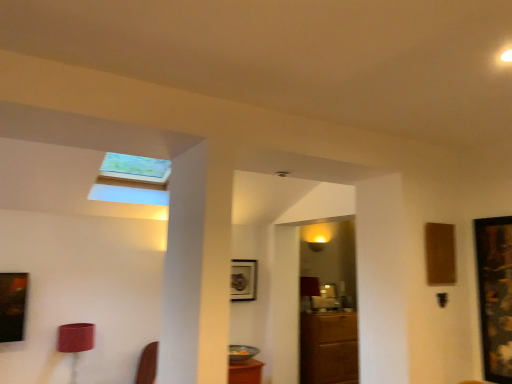
What do you see at coordinates (495, 295) in the screenshot? I see `wooden framed artwork at right, the 2th picture frame positioned from the left` at bounding box center [495, 295].

In order to face metallic silver picture frame at center, placed as the second picture frame when sorted from front to back, should I rotate leftwards or rightwards?

To align with it, rotate left about 1.560°.

The image size is (512, 384). Describe the element at coordinates (328, 348) in the screenshot. I see `brown wooden cabinet at center` at that location.

The width and height of the screenshot is (512, 384). Identify the location of wooden framed artwork at right, acting as the 1th picture frame starting from the right. (495, 295).

What's the angular difference between brown wooden cabinet at center and metallic silver picture frame at center, placed as the second picture frame when sorted from front to back,'s facing directions?

They differ by 1.19 degrees in their facing directions.

Is brown wooden cabinet at center positioned beyond the bounds of metallic silver picture frame at center, placed as the second picture frame when sorted from front to back?

Yes.

From a real-world perspective, which is physically below, brown wooden cabinet at center or metallic silver picture frame at center, marked as the 2th picture frame in a right-to-left arrangement?

brown wooden cabinet at center.

Considering the points (352, 311) and (234, 268), which point is behind, point (352, 311) or point (234, 268)?

The point (352, 311) is farther from the camera.

Would you consider wooden framed artwork at right, the 2th picture frame positioned from the left, to be distant from brown wooden cabinet at center?

wooden framed artwork at right, the 2th picture frame positioned from the left, is far away from brown wooden cabinet at center.

Based on the photo, from a real-world perspective, who is located higher, wooden framed artwork at right, the 2th picture frame positioned from the left, or brown wooden cabinet at center?

wooden framed artwork at right, the 2th picture frame positioned from the left.

In the scene shown: Is wooden framed artwork at right, acting as the 1th picture frame starting from the right, located outside brown wooden cabinet at center?

Indeed, wooden framed artwork at right, acting as the 1th picture frame starting from the right, is completely outside brown wooden cabinet at center.

Does wooden framed artwork at right, acting as the 1th picture frame starting from the right, have a greater width compared to brown wooden cabinet at center?

In fact, wooden framed artwork at right, acting as the 1th picture frame starting from the right, might be narrower than brown wooden cabinet at center.

How different are the orientations of metallic silver picture frame at center, which is counted as the 1th picture frame, starting from the back, and brown wooden cabinet at center in degrees?

1.19 degrees separate the facing orientations of metallic silver picture frame at center, which is counted as the 1th picture frame, starting from the back, and brown wooden cabinet at center.

Which is farther, (236, 271) or (334, 345)?

The point (334, 345) is farther.

Can you confirm if metallic silver picture frame at center, which is counted as the 1th picture frame, starting from the back, is smaller than brown wooden cabinet at center?

Yes, metallic silver picture frame at center, which is counted as the 1th picture frame, starting from the back, is smaller than brown wooden cabinet at center.

Is metallic silver picture frame at center, which is counted as the 1th picture frame, starting from the back, aimed at wooden framed artwork at right, the first picture frame when ordered from front to back?

Yes, metallic silver picture frame at center, which is counted as the 1th picture frame, starting from the back, is facing wooden framed artwork at right, the first picture frame when ordered from front to back.

How distant is metallic silver picture frame at center, placed as the second picture frame when sorted from front to back, from wooden framed artwork at right, the first picture frame when ordered from front to back?

metallic silver picture frame at center, placed as the second picture frame when sorted from front to back, and wooden framed artwork at right, the first picture frame when ordered from front to back, are 3.04 meters apart from each other.

Is wooden framed artwork at right, the first picture frame when ordered from front to back, completely or partially inside metallic silver picture frame at center, acting as the first picture frame starting from the left?

No, wooden framed artwork at right, the first picture frame when ordered from front to back, is not a part of metallic silver picture frame at center, acting as the first picture frame starting from the left.

Considering the relative positions of metallic silver picture frame at center, placed as the second picture frame when sorted from front to back, and wooden framed artwork at right, the first picture frame when ordered from front to back, in the image provided, is metallic silver picture frame at center, placed as the second picture frame when sorted from front to back, to the right of wooden framed artwork at right, the first picture frame when ordered from front to back, from the viewer's perspective?

In fact, metallic silver picture frame at center, placed as the second picture frame when sorted from front to back, is to the left of wooden framed artwork at right, the first picture frame when ordered from front to back.

From the picture: Is brown wooden cabinet at center positioned far away from wooden framed artwork at right, the first picture frame when ordered from front to back?

Yes, brown wooden cabinet at center and wooden framed artwork at right, the first picture frame when ordered from front to back, are quite far apart.

From the image's perspective, between brown wooden cabinet at center and wooden framed artwork at right, arranged as the 2th picture frame when viewed from the back, which one is located above?

wooden framed artwork at right, arranged as the 2th picture frame when viewed from the back, from the image's perspective.

From the picture: Does brown wooden cabinet at center appear on the left side of wooden framed artwork at right, acting as the 1th picture frame starting from the right?

Correct, you'll find brown wooden cabinet at center to the left of wooden framed artwork at right, acting as the 1th picture frame starting from the right.

Based on their positions, is wooden framed artwork at right, acting as the 1th picture frame starting from the right, located to the left or right of metallic silver picture frame at center, acting as the first picture frame starting from the left?

wooden framed artwork at right, acting as the 1th picture frame starting from the right, is positioned on metallic silver picture frame at center, acting as the first picture frame starting from the left,'s right side.

Measure the distance between wooden framed artwork at right, arranged as the 2th picture frame when viewed from the back, and metallic silver picture frame at center, acting as the first picture frame starting from the left.

wooden framed artwork at right, arranged as the 2th picture frame when viewed from the back, is 3.04 meters away from metallic silver picture frame at center, acting as the first picture frame starting from the left.

Between wooden framed artwork at right, acting as the 1th picture frame starting from the right, and metallic silver picture frame at center, acting as the first picture frame starting from the left, which one has more height?

Standing taller between the two is wooden framed artwork at right, acting as the 1th picture frame starting from the right.

From the image's perspective, is wooden framed artwork at right, the 2th picture frame positioned from the left, located beneath metallic silver picture frame at center, acting as the first picture frame starting from the left?

No, from the image's perspective, wooden framed artwork at right, the 2th picture frame positioned from the left, is not below metallic silver picture frame at center, acting as the first picture frame starting from the left.

The height and width of the screenshot is (384, 512). I want to click on the 2nd picture frame directly above the brown wooden cabinet at center (from a real-world perspective), so click(x=243, y=279).

I want to click on the 2nd picture frame above when counting from the brown wooden cabinet at center (from the image's perspective), so click(495, 295).

Which object lies further to the anchor point metallic silver picture frame at center, marked as the 2th picture frame in a right-to-left arrangement, brown wooden cabinet at center or wooden framed artwork at right, acting as the 1th picture frame starting from the right?

wooden framed artwork at right, acting as the 1th picture frame starting from the right, is further to metallic silver picture frame at center, marked as the 2th picture frame in a right-to-left arrangement.

Which object lies nearer to the anchor point brown wooden cabinet at center, metallic silver picture frame at center, marked as the 2th picture frame in a right-to-left arrangement, or wooden framed artwork at right, arranged as the 2th picture frame when viewed from the back?

metallic silver picture frame at center, marked as the 2th picture frame in a right-to-left arrangement, is positioned closer to the anchor brown wooden cabinet at center.

Looking at the image, which one is located closer to brown wooden cabinet at center, wooden framed artwork at right, arranged as the 2th picture frame when viewed from the back, or metallic silver picture frame at center, acting as the first picture frame starting from the left?

The object closer to brown wooden cabinet at center is metallic silver picture frame at center, acting as the first picture frame starting from the left.

Consider the image. When comparing their distances from metallic silver picture frame at center, placed as the second picture frame when sorted from front to back, does wooden framed artwork at right, the first picture frame when ordered from front to back, or brown wooden cabinet at center seem closer?

The object closer to metallic silver picture frame at center, placed as the second picture frame when sorted from front to back, is brown wooden cabinet at center.

Based on their spatial positions, is brown wooden cabinet at center or metallic silver picture frame at center, marked as the 2th picture frame in a right-to-left arrangement, further from wooden framed artwork at right, the 2th picture frame positioned from the left?

The object further to wooden framed artwork at right, the 2th picture frame positioned from the left, is brown wooden cabinet at center.

Based on their spatial positions, is metallic silver picture frame at center, placed as the second picture frame when sorted from front to back, or brown wooden cabinet at center further from wooden framed artwork at right, the first picture frame when ordered from front to back?

brown wooden cabinet at center is further to wooden framed artwork at right, the first picture frame when ordered from front to back.

Where is `picture frame positioned between wooden framed artwork at right, the 2th picture frame positioned from the left, and brown wooden cabinet at center from near to far`? picture frame positioned between wooden framed artwork at right, the 2th picture frame positioned from the left, and brown wooden cabinet at center from near to far is located at coordinates (243, 279).